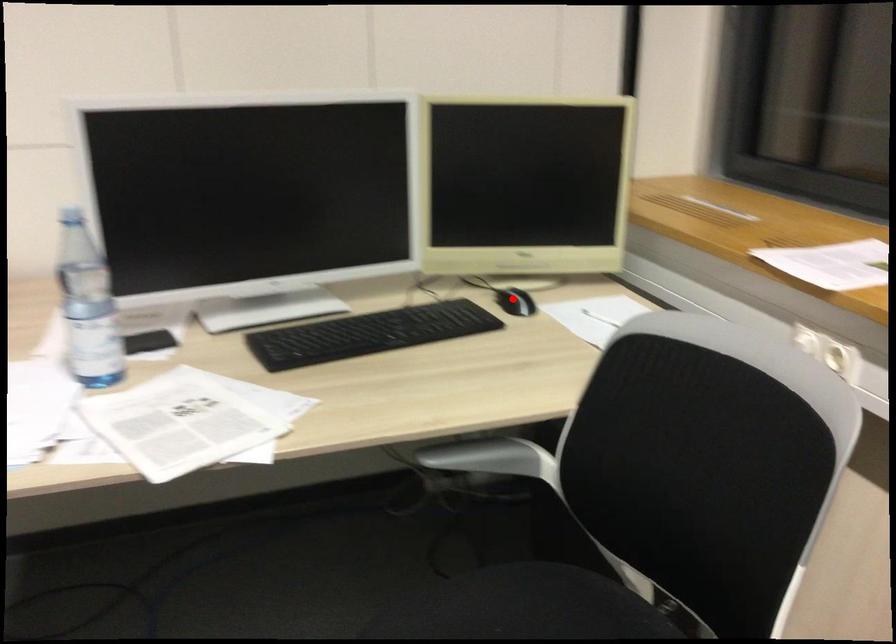
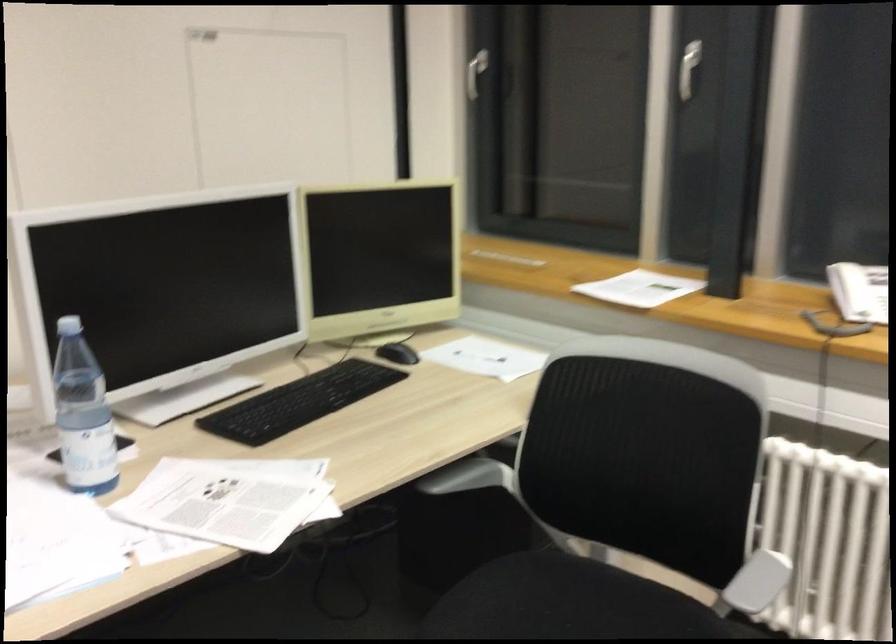
Question: I am providing you with two images of the same scene from different viewpoints. Image1 has a red point marked. In image2, the corresponding 3D location appears at what relative position? Reply with the corresponding letter.

Choices:
 (A) Closer
 (B) Farther

Answer: (B)